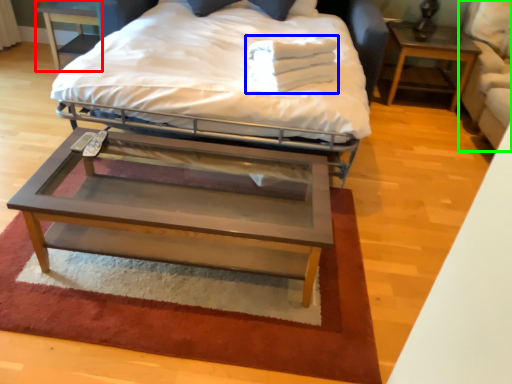
Question: Which object is positioned farthest from nightstand (highlighted by a red box)? Select from material (highlighted by a blue box) and swivel chair (highlighted by a green box).

Choices:
 (A) material
 (B) swivel chair

Answer: (B)